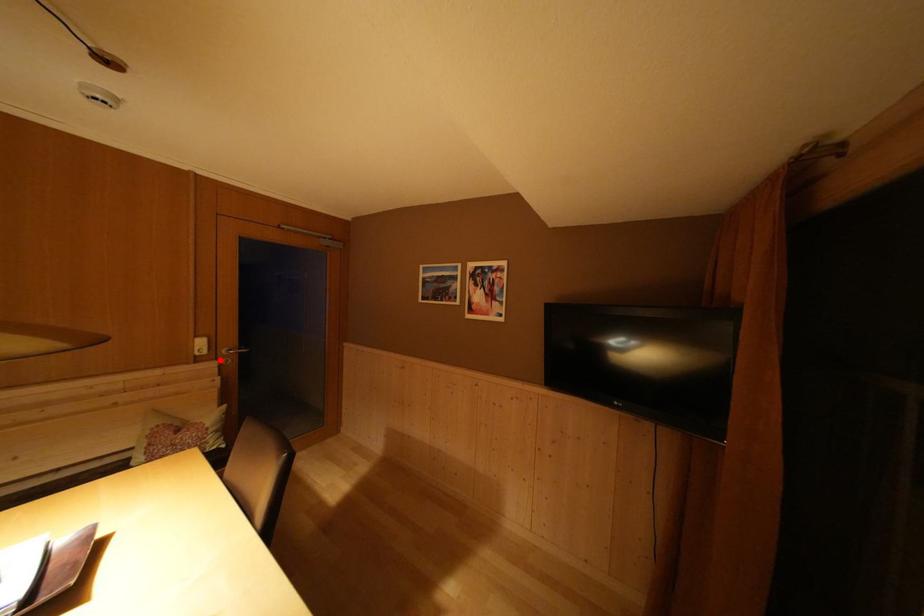
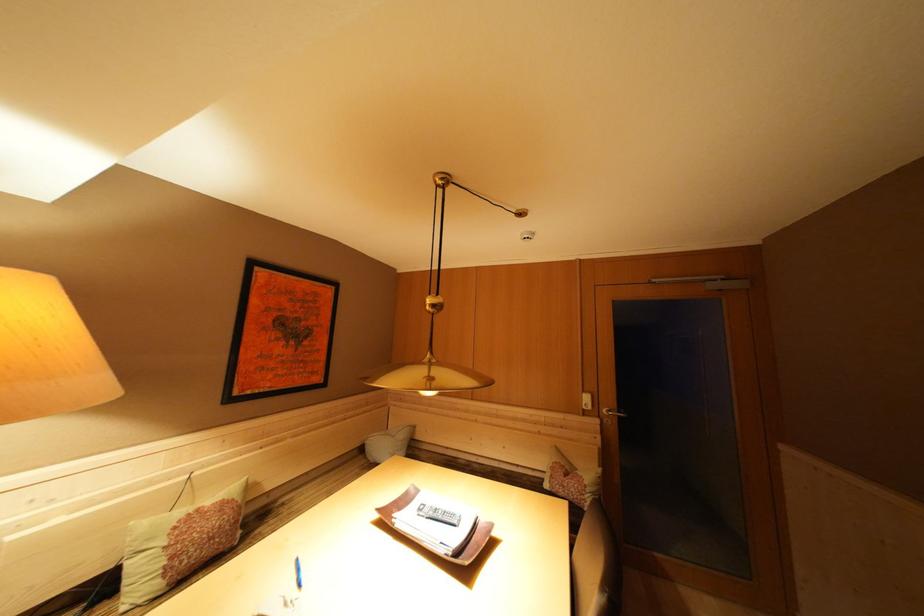
Question: I am providing you with two images of the same scene from different viewpoints. Image1 has a red point marked. In image2, the corresponding 3D location appears at what relative position? Reply with the corresponding letter.

Choices:
 (A) Closer
 (B) Farther

Answer: (B)